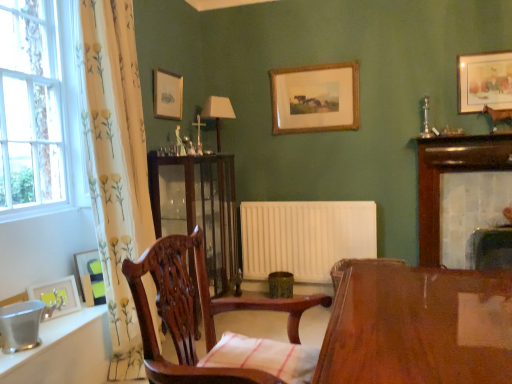
The image size is (512, 384). In order to click on free point above white tile fireplace at upper right (from a real-world perspective) in this screenshot , I will do `click(476, 141)`.